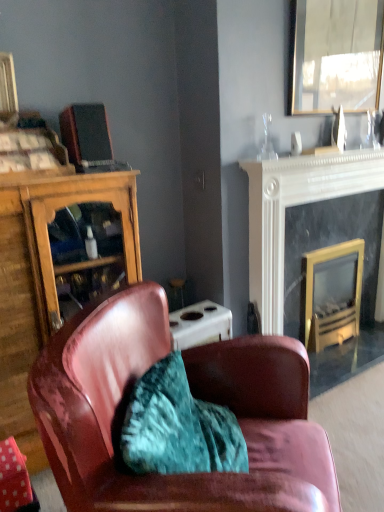
Question: Should I look upward or downward to see wooden cabinet at left?

Choices:
 (A) up
 (B) down

Answer: (B)

Question: Is metallic reflective mirror at upper right taller than black marble fireplace at upper right, placed as the 1th fireplace when sorted from right to left?

Choices:
 (A) no
 (B) yes

Answer: (A)

Question: Is metallic reflective mirror at upper right placed right next to black marble fireplace at upper right, placed as the 1th fireplace when sorted from right to left?

Choices:
 (A) yes
 (B) no

Answer: (B)

Question: Is metallic reflective mirror at upper right behind black marble fireplace at upper right, placed as the 1th fireplace when sorted from right to left?

Choices:
 (A) yes
 (B) no

Answer: (B)

Question: Is metallic reflective mirror at upper right positioned with its back to black marble fireplace at upper right, placed as the 2th fireplace when sorted from left to right?

Choices:
 (A) no
 (B) yes

Answer: (A)

Question: Is metallic reflective mirror at upper right bigger than black marble fireplace at upper right, placed as the 2th fireplace when sorted from left to right?

Choices:
 (A) yes
 (B) no

Answer: (B)

Question: From the image's perspective, is metallic reflective mirror at upper right over black marble fireplace at upper right, placed as the 1th fireplace when sorted from right to left?

Choices:
 (A) no
 (B) yes

Answer: (B)

Question: From a real-world perspective, is gold-framed glass fireplace at right, which is the second fireplace from right to left, over leather armchair at center?

Choices:
 (A) no
 (B) yes

Answer: (A)

Question: Does gold-framed glass fireplace at right, which is the second fireplace from right to left, have a larger size compared to leather armchair at center?

Choices:
 (A) no
 (B) yes

Answer: (A)

Question: Does gold-framed glass fireplace at right, which is the second fireplace from right to left, appear on the right side of leather armchair at center?

Choices:
 (A) no
 (B) yes

Answer: (B)

Question: Are gold-framed glass fireplace at right, marked as the 1th fireplace in a left-to-right arrangement, and leather armchair at center located far from each other?

Choices:
 (A) yes
 (B) no

Answer: (A)

Question: From a real-world perspective, is gold-framed glass fireplace at right, marked as the 1th fireplace in a left-to-right arrangement, physically below leather armchair at center?

Choices:
 (A) yes
 (B) no

Answer: (A)

Question: Is gold-framed glass fireplace at right, marked as the 1th fireplace in a left-to-right arrangement, positioned behind leather armchair at center?

Choices:
 (A) yes
 (B) no

Answer: (A)

Question: Is leather armchair at center thinner than black marble fireplace at upper right, placed as the 2th fireplace when sorted from left to right?

Choices:
 (A) yes
 (B) no

Answer: (B)